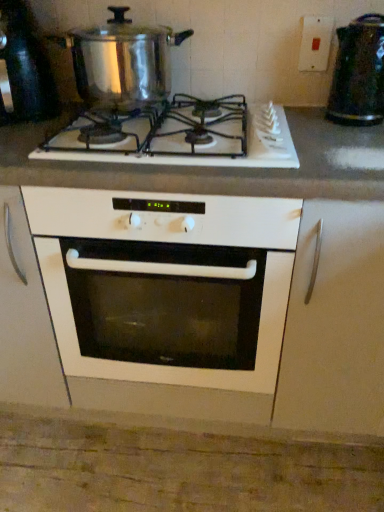
Question: Is shiny metallic pot at upper left, positioned as the 1th appliance in left-to-right order, thinner than white glossy gas stove at center?

Choices:
 (A) no
 (B) yes

Answer: (B)

Question: Is shiny metallic pot at upper left, which is counted as the 2th appliance, starting from the right, facing away from white glossy gas stove at center?

Choices:
 (A) yes
 (B) no

Answer: (B)

Question: From the image's perspective, is shiny metallic pot at upper left, which is counted as the 2th appliance, starting from the right, beneath white glossy gas stove at center?

Choices:
 (A) yes
 (B) no

Answer: (B)

Question: From a real-world perspective, is shiny metallic pot at upper left, positioned as the 1th appliance in left-to-right order, over white glossy gas stove at center?

Choices:
 (A) yes
 (B) no

Answer: (A)

Question: Is shiny metallic pot at upper left, positioned as the 1th appliance in left-to-right order, bigger than white glossy gas stove at center?

Choices:
 (A) yes
 (B) no

Answer: (A)

Question: Does shiny metallic pot at upper left, which is counted as the 2th appliance, starting from the right, appear on the right side of white glossy gas stove at center?

Choices:
 (A) no
 (B) yes

Answer: (A)

Question: Does white plastic switch at upper right have a lesser width compared to white matte cabinet door at right?

Choices:
 (A) no
 (B) yes

Answer: (B)

Question: Considering the relative sizes of white plastic switch at upper right and white matte cabinet door at right in the image provided, is white plastic switch at upper right taller than white matte cabinet door at right?

Choices:
 (A) no
 (B) yes

Answer: (A)

Question: Is white plastic switch at upper right facing towards white matte cabinet door at right?

Choices:
 (A) yes
 (B) no

Answer: (B)

Question: Is white matte cabinet door at right at the back of white plastic switch at upper right?

Choices:
 (A) no
 (B) yes

Answer: (A)

Question: Can you confirm if white plastic switch at upper right is positioned to the left of white matte cabinet door at right?

Choices:
 (A) no
 (B) yes

Answer: (B)

Question: Is white plastic switch at upper right located outside white matte cabinet door at right?

Choices:
 (A) yes
 (B) no

Answer: (A)

Question: Is white plastic switch at upper right shorter than shiny metallic pot at upper left, positioned as the 1th appliance in left-to-right order?

Choices:
 (A) no
 (B) yes

Answer: (B)